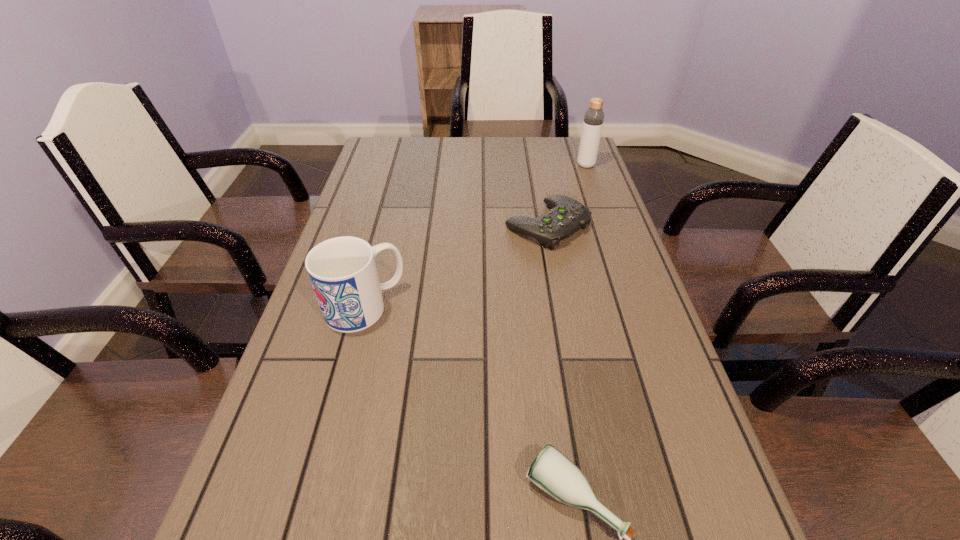
This screenshot has height=540, width=960. What are the coordinates of `vacant area that lies between the third farthest object and the farther bottle` in the screenshot? It's located at (475, 236).

I want to click on free area in between the farther bottle and the third nearest object, so click(x=566, y=195).

The image size is (960, 540). In order to click on free space between the second nearest object and the shortest object in this screenshot , I will do `click(456, 266)`.

I want to click on the second closest object to the farther bottle, so click(342, 270).

Image resolution: width=960 pixels, height=540 pixels. I want to click on object that is the third closest one to the nearer bottle, so click(593, 121).